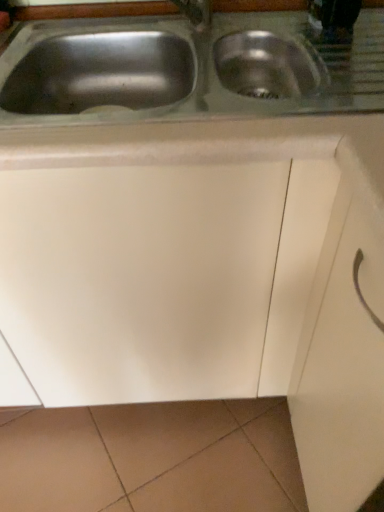
You are a GUI agent. You are given a task and a screenshot of the screen. Output one action in this format:
    pyautogui.click(x=<x>, y=<y>)
    Task: Click on the white matte drawer at center
    The image size is (384, 512).
    Given the screenshot: What is the action you would take?
    pyautogui.click(x=341, y=368)

The height and width of the screenshot is (512, 384). What do you see at coordinates (341, 368) in the screenshot? I see `white matte drawer at center` at bounding box center [341, 368].

In order to face white matte drawer at center, should I rotate leftwards or rightwards?

To align with it, rotate right about 25.613°.

You are a GUI agent. You are given a task and a screenshot of the screen. Output one action in this format:
    pyautogui.click(x=<x>, y=<y>)
    Task: Click on the stainless steel sink at center
    This screenshot has width=384, height=512.
    Given the screenshot: What is the action you would take?
    pyautogui.click(x=186, y=69)

Describe the element at coordinates (186, 69) in the screenshot. I see `stainless steel sink at center` at that location.

Locate an element on the screen. Image resolution: width=384 pixels, height=512 pixels. white matte drawer at center is located at coordinates (341, 368).

Considering the relative positions of white matte drawer at center and stainless steel sink at center in the image provided, is white matte drawer at center to the right of stainless steel sink at center from the viewer's perspective?

Indeed, white matte drawer at center is positioned on the right side of stainless steel sink at center.

Is white matte drawer at center further to camera compared to stainless steel sink at center?

No, white matte drawer at center is closer to the viewer.

Does point (354, 392) come closer to viewer compared to point (59, 33)?

Yes.

From the image's perspective, which is above, white matte drawer at center or stainless steel sink at center?

From the image's view, stainless steel sink at center is above.

From the picture: From a real-world perspective, between white matte drawer at center and stainless steel sink at center, who is vertically lower?

white matte drawer at center, from a real-world perspective.

Can you confirm if white matte drawer at center is wider than stainless steel sink at center?

No.

Does white matte drawer at center have a lesser height compared to stainless steel sink at center?

Incorrect, the height of white matte drawer at center does not fall short of that of stainless steel sink at center.

Is white matte drawer at center bigger than stainless steel sink at center?

No, white matte drawer at center is not bigger than stainless steel sink at center.

Do you think white matte drawer at center is within stainless steel sink at center, or outside of it?

white matte drawer at center cannot be found inside stainless steel sink at center.

Are white matte drawer at center and stainless steel sink at center making contact?

There is a gap between white matte drawer at center and stainless steel sink at center.

Is white matte drawer at center facing towards stainless steel sink at center?

No, white matte drawer at center does not turn towards stainless steel sink at center.

Can you tell me how much white matte drawer at center and stainless steel sink at center differ in facing direction?

89.6 degrees separate the facing orientations of white matte drawer at center and stainless steel sink at center.

How far apart are white matte drawer at center and stainless steel sink at center?

white matte drawer at center and stainless steel sink at center are 17.84 inches apart.

Locate an element on the screen. This screenshot has height=512, width=384. sink above the white matte drawer at center (from the image's perspective) is located at coordinates (186, 69).

Does stainless steel sink at center appear on the right side of white matte drawer at center?

In fact, stainless steel sink at center is to the left of white matte drawer at center.

Is the depth of stainless steel sink at center less than that of white matte drawer at center?

No, stainless steel sink at center is further to the viewer.

Does point (369, 103) appear closer or farther from the camera than point (366, 281)?

Clearly, point (369, 103) is more distant from the camera than point (366, 281).

From the image's perspective, which object appears higher, stainless steel sink at center or white matte drawer at center?

stainless steel sink at center appears higher in the image.

From a real-world perspective, who is located lower, stainless steel sink at center or white matte drawer at center?

white matte drawer at center.

Considering the sizes of objects stainless steel sink at center and white matte drawer at center in the image provided, who is wider, stainless steel sink at center or white matte drawer at center?

With larger width is stainless steel sink at center.

Considering the relative sizes of stainless steel sink at center and white matte drawer at center in the image provided, is stainless steel sink at center taller than white matte drawer at center?

No, stainless steel sink at center is not taller than white matte drawer at center.

In the scene shown: Considering the sizes of stainless steel sink at center and white matte drawer at center in the image, is stainless steel sink at center bigger or smaller than white matte drawer at center?

In the image, stainless steel sink at center appears to be larger than white matte drawer at center.

Is stainless steel sink at center inside or outside of white matte drawer at center?

stainless steel sink at center cannot be found inside white matte drawer at center.

Is stainless steel sink at center far from white matte drawer at center?

stainless steel sink at center is actually quite close to white matte drawer at center.

Is stainless steel sink at center oriented towards white matte drawer at center?

No, stainless steel sink at center is not aimed at white matte drawer at center.

How many degrees apart are the facing directions of stainless steel sink at center and white matte drawer at center?

The angular difference between stainless steel sink at center and white matte drawer at center is 89.6 degrees.

Measure the distance from stainless steel sink at center to white matte drawer at center.

17.84 inches.

Locate an element on the screen. The image size is (384, 512). sink on the left of white matte drawer at center is located at coordinates (186, 69).

Image resolution: width=384 pixels, height=512 pixels. I want to click on sink on the left of white matte drawer at center, so click(186, 69).

Where is `drawer in front of the stainless steel sink at center`? The width and height of the screenshot is (384, 512). drawer in front of the stainless steel sink at center is located at coordinates (341, 368).